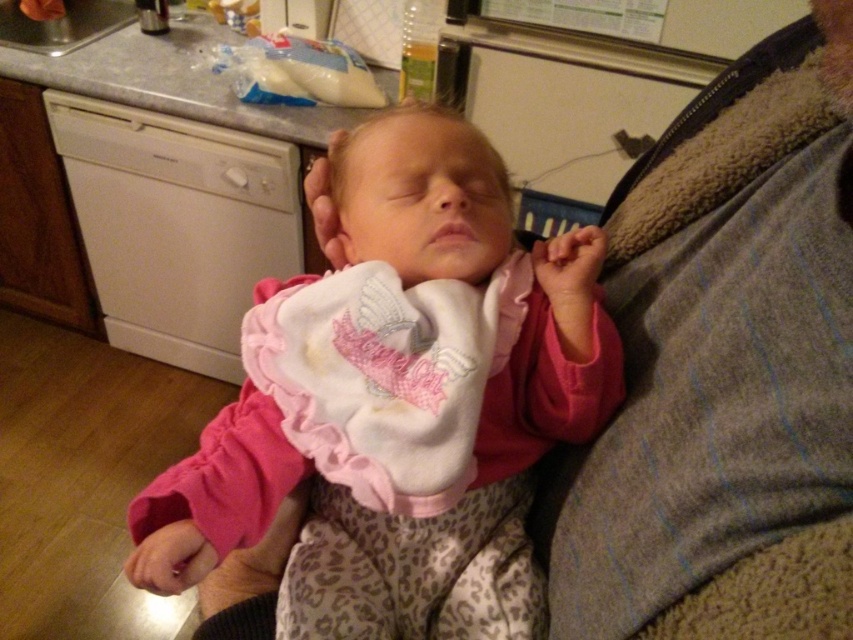
Does pink fleece baby at center appear over white soft bib at center?

No.

The width and height of the screenshot is (853, 640). What do you see at coordinates (399, 403) in the screenshot?
I see `pink fleece baby at center` at bounding box center [399, 403].

You are a GUI agent. You are given a task and a screenshot of the screen. Output one action in this format:
    pyautogui.click(x=<x>, y=<y>)
    Task: Click on the pink fleece baby at center
    This screenshot has height=640, width=853.
    Given the screenshot: What is the action you would take?
    pyautogui.click(x=399, y=403)